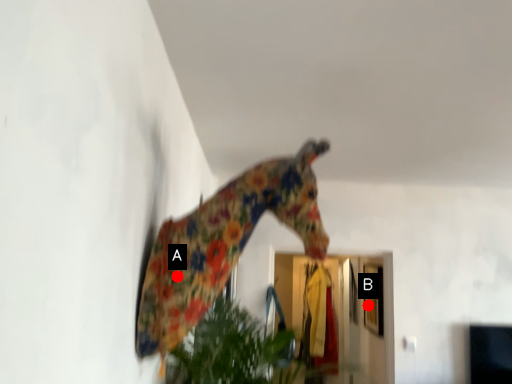
Question: Two points are circled on the image, labeled by A and B beside each circle. Which of the following is the farthest from the observer?

Choices:
 (A) A is further
 (B) B is further

Answer: (B)